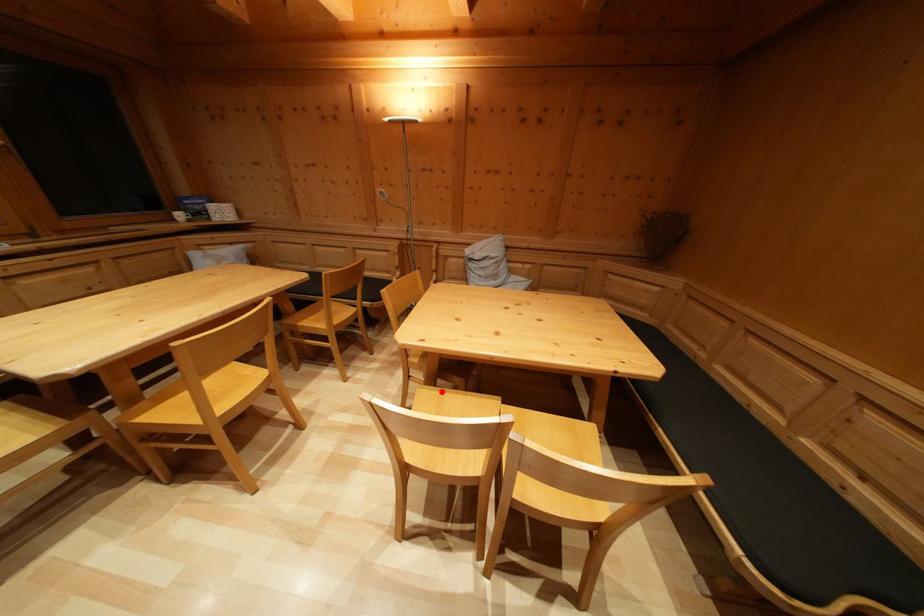
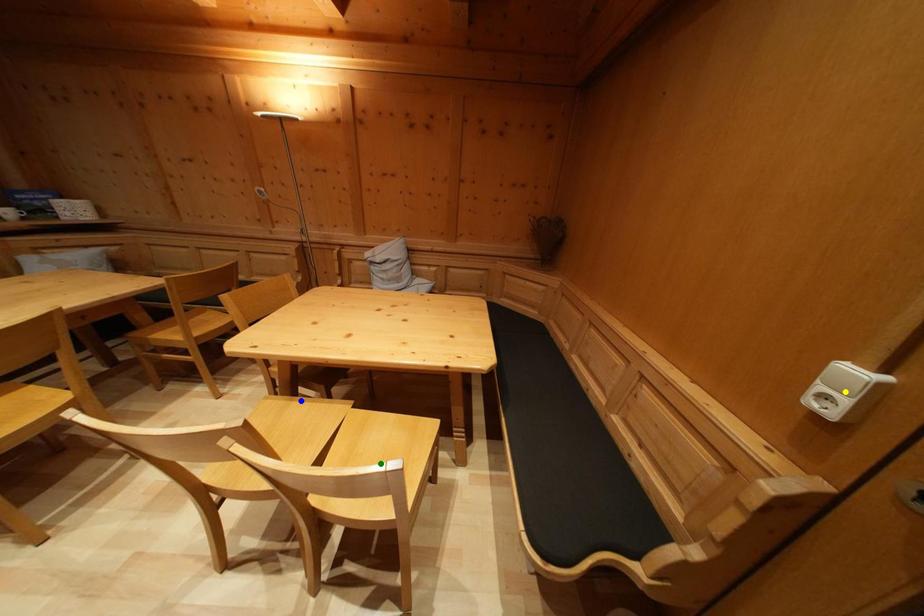
Question: I am providing you with two images of the same scene from different viewpoints. A red point is marked on the first image. You are given multiple points on the second image. Can you choose the point in image 2 that corresponds to the point in image 1?

Choices:
 (A) yellow point
 (B) blue point
 (C) green point

Answer: (B)